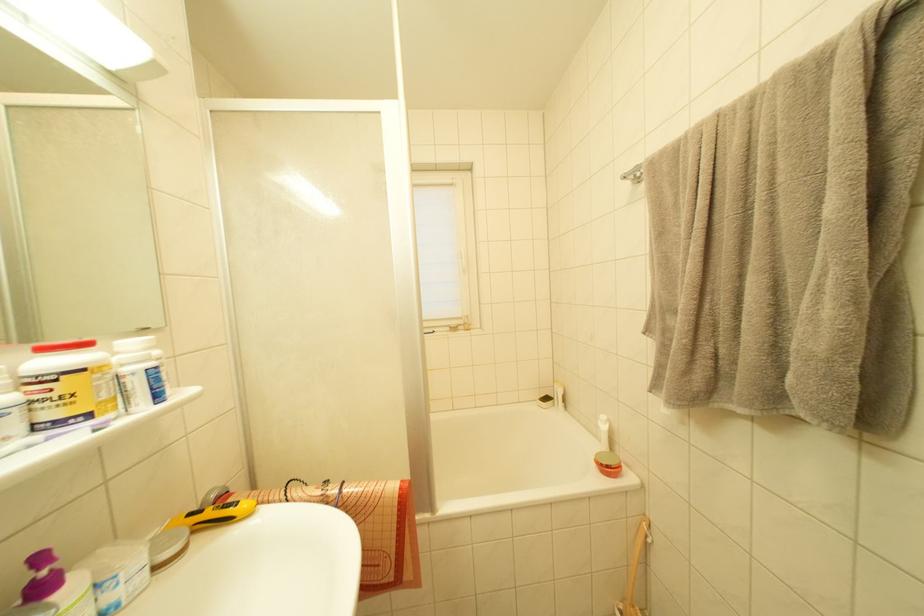
Find the location of a particular element. The image size is (924, 616). white supplement jar is located at coordinates (140, 373).